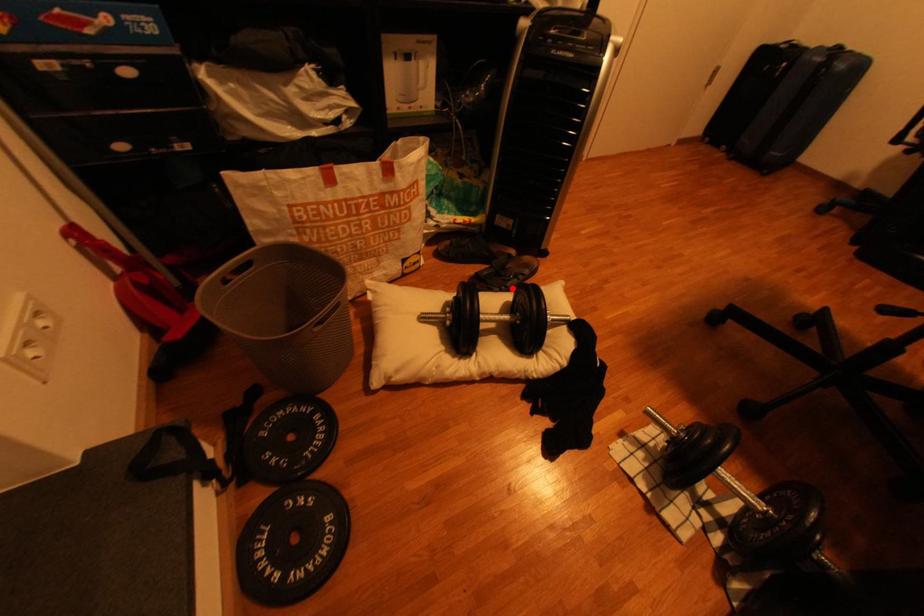
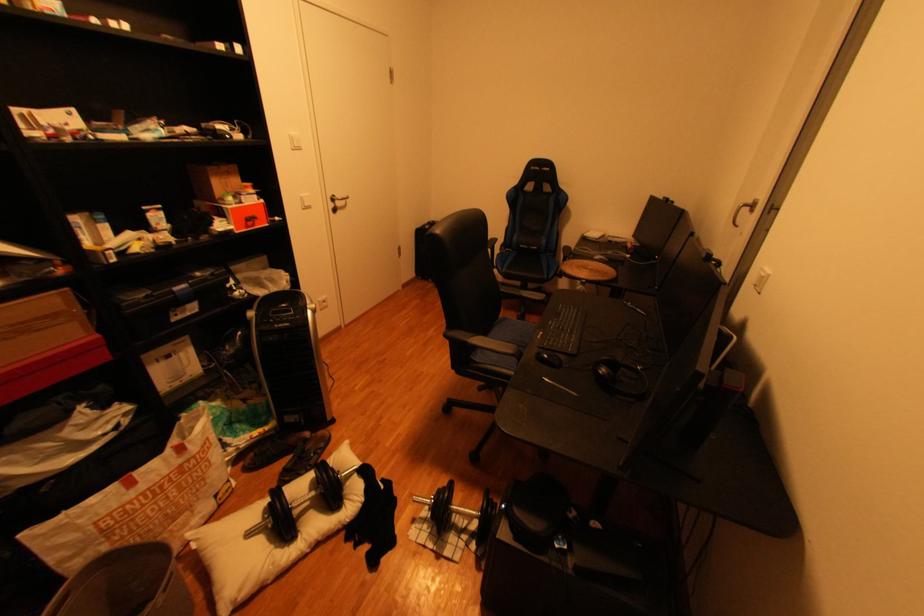
Locate, in the second image, the point that corresponds to the highlighted location in the first image.

(318, 468)